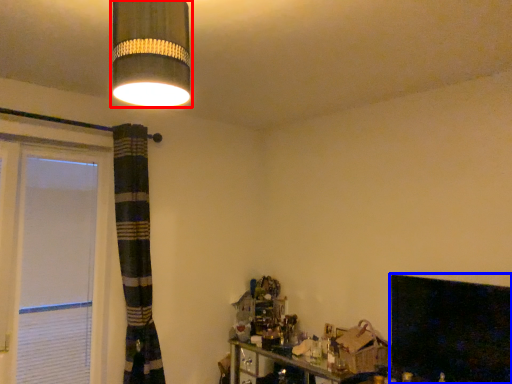
Question: Which point is closer to the camera, lamp (highlighted by a red box) or fireplace (highlighted by a blue box)?

Choices:
 (A) lamp
 (B) fireplace

Answer: (A)